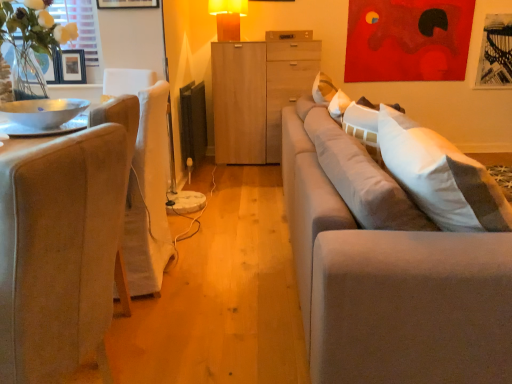
Question: From the image's perspective, does metallic silver bowl at left appear lower than wooden drawer at center?

Choices:
 (A) no
 (B) yes

Answer: (B)

Question: Is the depth of metallic silver bowl at left greater than that of wooden drawer at center?

Choices:
 (A) yes
 (B) no

Answer: (B)

Question: Considering the relative sizes of metallic silver bowl at left and wooden drawer at center in the image provided, is metallic silver bowl at left bigger than wooden drawer at center?

Choices:
 (A) no
 (B) yes

Answer: (A)

Question: Would you say metallic silver bowl at left is a long distance from wooden drawer at center?

Choices:
 (A) no
 (B) yes

Answer: (B)

Question: From a real-world perspective, is metallic silver bowl at left physically below wooden drawer at center?

Choices:
 (A) yes
 (B) no

Answer: (A)

Question: From the image's perspective, is wooden drawer at center positioned above or below beige fabric chair at left?

Choices:
 (A) below
 (B) above

Answer: (B)

Question: Is wooden drawer at center to the left or to the right of beige fabric chair at left in the image?

Choices:
 (A) left
 (B) right

Answer: (B)

Question: From their relative heights in the image, would you say wooden drawer at center is taller or shorter than beige fabric chair at left?

Choices:
 (A) tall
 (B) short

Answer: (B)

Question: Is wooden drawer at center inside or outside of beige fabric chair at left?

Choices:
 (A) inside
 (B) outside

Answer: (B)

Question: Based on their sizes in the image, would you say light gray fabric couch at right is bigger or smaller than beige fabric chair at left?

Choices:
 (A) big
 (B) small

Answer: (A)

Question: In the image, is light gray fabric couch at right positioned in front of or behind beige fabric chair at left?

Choices:
 (A) behind
 (B) front

Answer: (A)

Question: From a real-world perspective, is light gray fabric couch at right physically located above or below beige fabric chair at left?

Choices:
 (A) below
 (B) above

Answer: (A)

Question: Considering the positions of light gray fabric couch at right and beige fabric chair at left in the image, is light gray fabric couch at right taller or shorter than beige fabric chair at left?

Choices:
 (A) short
 (B) tall

Answer: (A)

Question: From a real-world perspective, is wooden drawer at center positioned above or below light wood cabinet at center?

Choices:
 (A) below
 (B) above

Answer: (B)

Question: Is wooden drawer at center spatially inside light wood cabinet at center, or outside of it?

Choices:
 (A) inside
 (B) outside

Answer: (B)